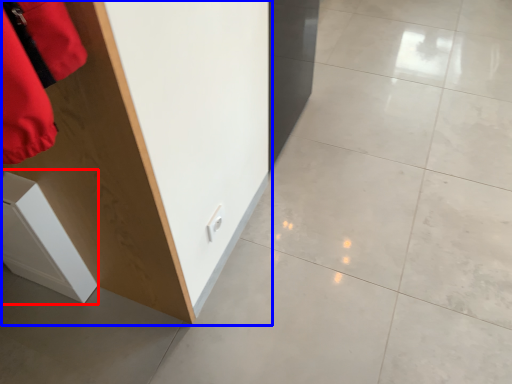
Question: Which object is further to the camera taking this photo, cabinetry (highlighted by a red box) or furniture (highlighted by a blue box)?

Choices:
 (A) cabinetry
 (B) furniture

Answer: (A)